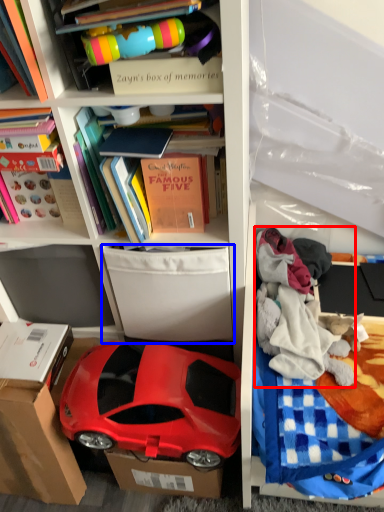
Question: Which object appears farthest to the camera in this image, clothing (highlighted by a red box) or storage box (highlighted by a blue box)?

Choices:
 (A) clothing
 (B) storage box

Answer: (A)